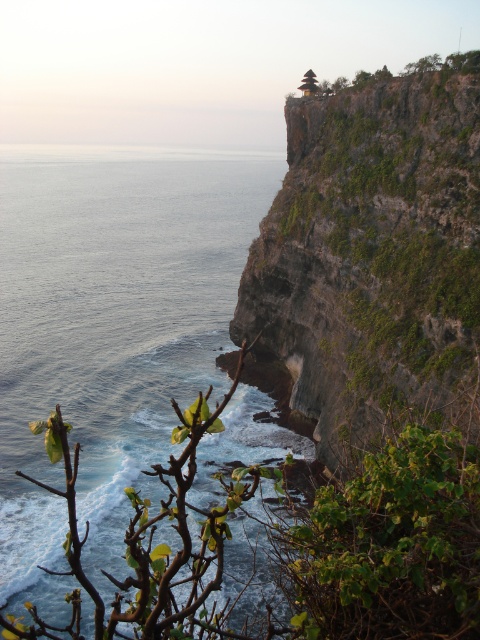
You are a drone operator tasked with capturing aerial footage of the coastal area. Your drone has a maximum flight range of 50 meters. You need to fly from the blue water at center to the green mossy cliff at upper right. Can your drone complete this flight without exceeding its range?

The distance between the blue water at center and the green mossy cliff at upper right is 50.01 meters, which exceeds the drone flight range of 50 meters. Therefore, the drone cannot complete the flight without exceeding its range.

You are standing on the beach and looking at the blue water at center and the green mossy cliff at upper right. Which object is closer to you?

The blue water at center is closer to you because it is further to the viewer than the green mossy cliff at upper right.